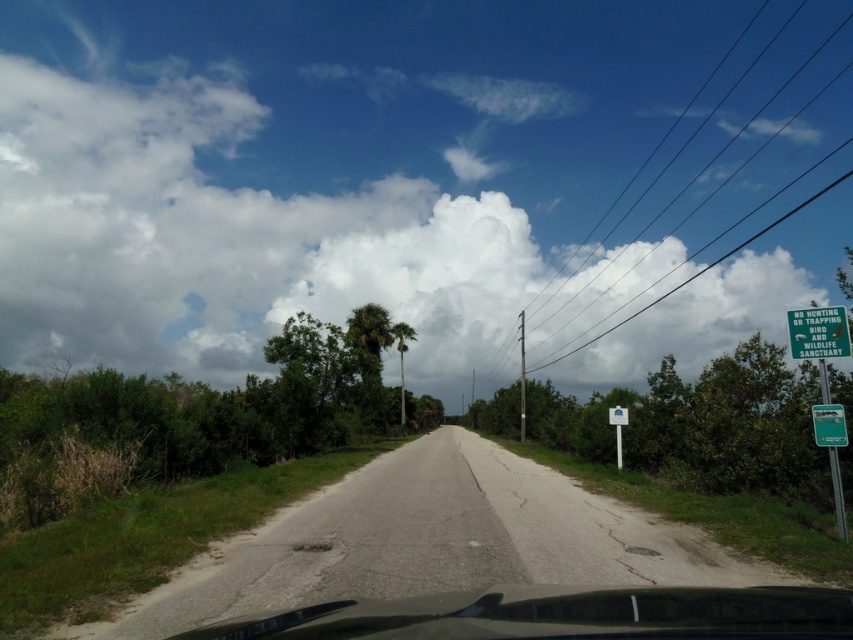
You are standing on the rural road and want to walk towards the two points marked in the scene. Which point, point (618, 252) or point (796, 317), will you reach first?

You will reach point (618, 252) first because it is closer to you than point (796, 317), which is further away.